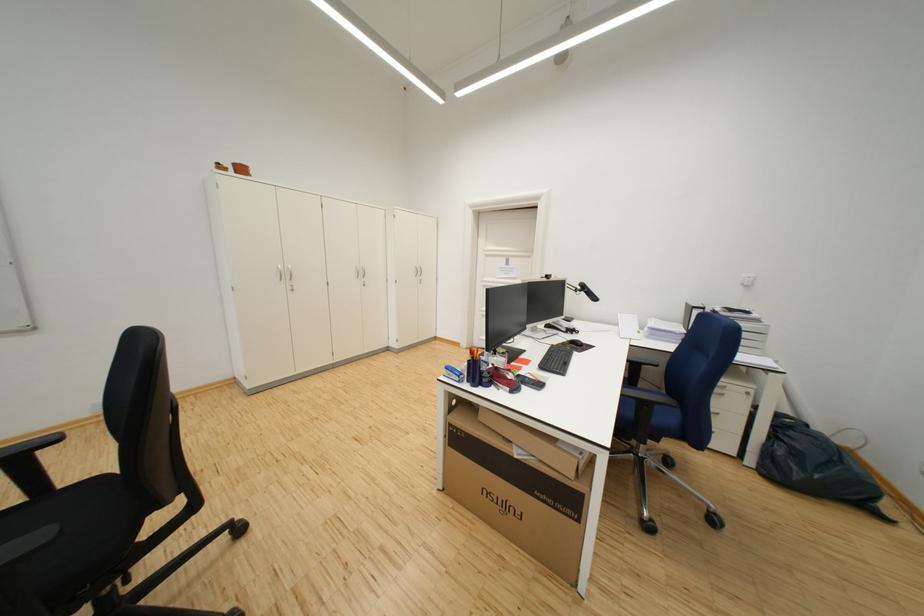
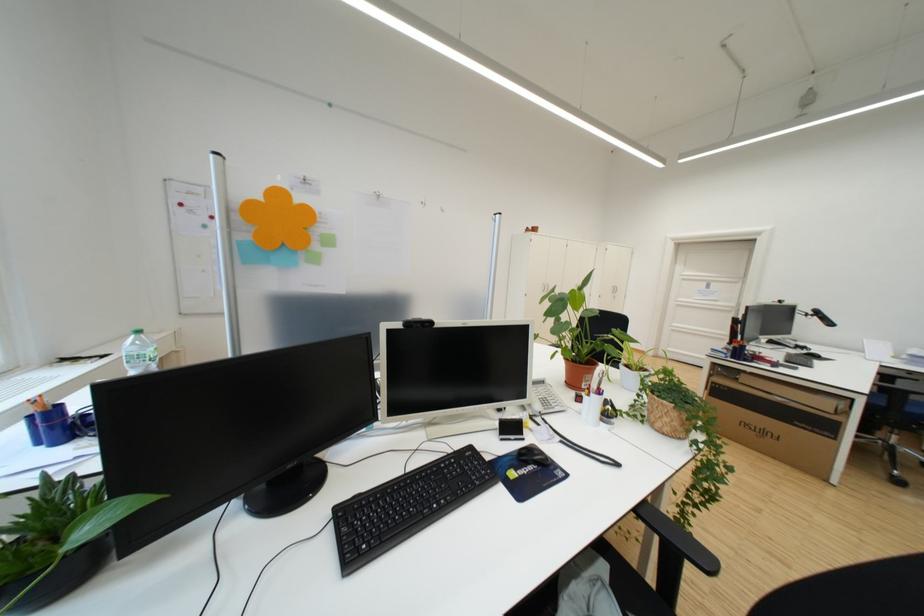
The images are taken continuously from a first-person perspective. In which direction are you moving?

The cameraman walked toward left, backward.